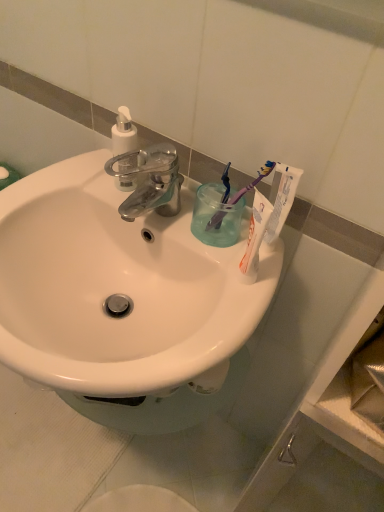
Question: Is white plastic soap dispenser at upper left taller or shorter than blue plastic toothbrush at upper right, the first toothbrush when ordered from left to right?

Choices:
 (A) tall
 (B) short

Answer: (A)

Question: From the image's perspective, relative to blue plastic toothbrush at upper right, the second toothbrush positioned from the right, is white plastic soap dispenser at upper left above or below?

Choices:
 (A) above
 (B) below

Answer: (A)

Question: Which object is the closest to the white matte toothpaste at upper right?

Choices:
 (A) purple plastic toothbrush at upper right, which is the second toothbrush in left-to-right order
 (B) white glossy sink at center
 (C) blue plastic toothbrush at upper right, the first toothbrush when ordered from left to right
 (D) transparent plastic cup at upper right
 (E) white plastic soap dispenser at upper left

Answer: (A)

Question: Which object is positioned farthest from the white plastic soap dispenser at upper left?

Choices:
 (A) blue plastic toothbrush at upper right, the first toothbrush when ordered from left to right
 (B) transparent plastic cup at upper right
 (C) white matte toothpaste at upper right
 (D) white glossy sink at center
 (E) purple plastic toothbrush at upper right, which is the first toothbrush from right to left

Answer: (C)